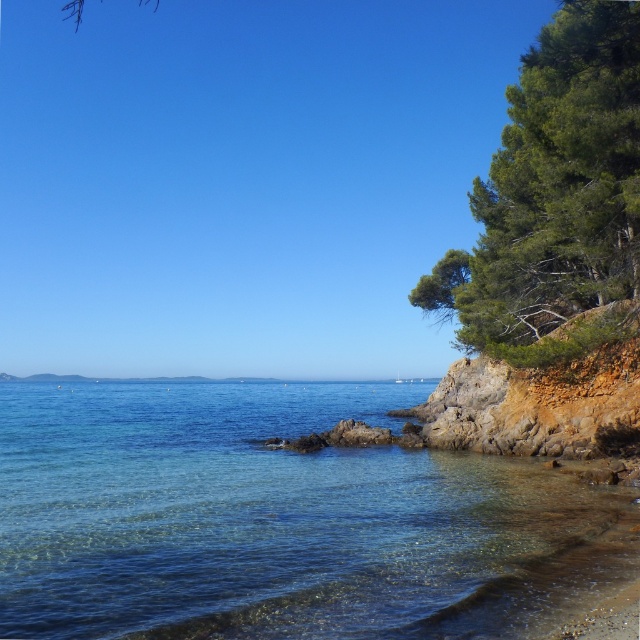
Can you confirm if clear water at lower right is positioned to the right of green textured tree at right?

No, clear water at lower right is not to the right of green textured tree at right.

Which is more to the left, clear water at lower right or green textured tree at right?

clear water at lower right

Identify the location of clear water at lower right. Image resolution: width=640 pixels, height=640 pixels. click(276, 520).

I want to click on clear water at lower right, so click(276, 520).